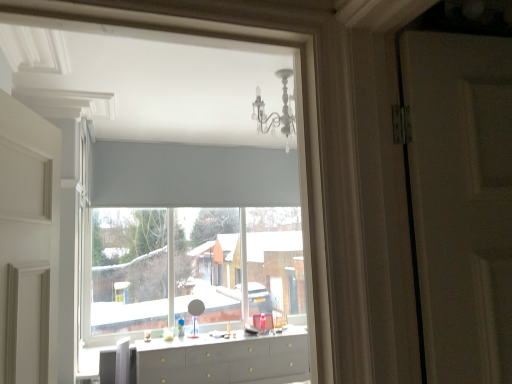
Locate an element on the screen. free space above matte gray dresser at center (from a real-world perspective) is located at coordinates (224, 333).